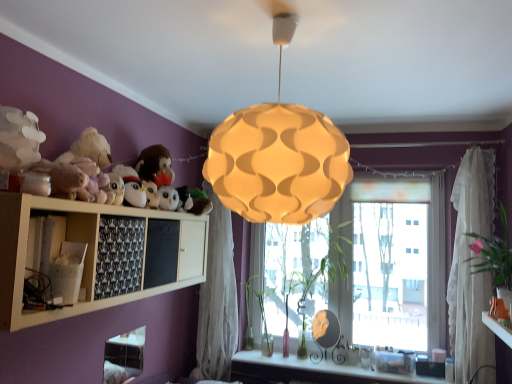
Question: Is fluffy white stuffed animal at upper left, positioned as the first toy in top-to-bottom order, in front of green leafy plant at right, which ranks as the first plant in front-to-back order?

Choices:
 (A) yes
 (B) no

Answer: (A)

Question: Does fluffy white stuffed animal at upper left, the second toy in the right-to-left sequence, have a greater width compared to green leafy plant at right, which is the 4th plant in left-to-right order?

Choices:
 (A) yes
 (B) no

Answer: (B)

Question: From the image's perspective, would you say fluffy white stuffed animal at upper left, the 1th toy in the front-to-back sequence, is shown under green leafy plant at right, which is the 4th plant in left-to-right order?

Choices:
 (A) no
 (B) yes

Answer: (A)

Question: Is fluffy white stuffed animal at upper left, positioned as the first toy in top-to-bottom order, turned away from green leafy plant at right, which ranks as the first plant in front-to-back order?

Choices:
 (A) yes
 (B) no

Answer: (B)

Question: Can you confirm if fluffy white stuffed animal at upper left, the 1th toy from the left, is shorter than green leafy plant at right, which is the first plant from right to left?

Choices:
 (A) no
 (B) yes

Answer: (B)

Question: Can you confirm if fluffy white stuffed animal at upper left, the 1th toy from the left, is thinner than green leafy plant at right, which is the 4th plant in left-to-right order?

Choices:
 (A) yes
 (B) no

Answer: (A)

Question: From the image's perspective, is black fabric at lower left, the second shelf when ordered from left to right, over green glass vase at window, the second plant viewed from the left?

Choices:
 (A) yes
 (B) no

Answer: (A)

Question: Considering the relative sizes of black fabric at lower left, which ranks as the 1th shelf in right-to-left order, and green glass vase at window, which is counted as the second plant, starting from the back, in the image provided, is black fabric at lower left, which ranks as the 1th shelf in right-to-left order, smaller than green glass vase at window, which is counted as the second plant, starting from the back,?

Choices:
 (A) yes
 (B) no

Answer: (A)

Question: Could you tell me if black fabric at lower left, which ranks as the 1th shelf in right-to-left order, is facing green glass vase at window, arranged as the third plant when viewed from the right?

Choices:
 (A) no
 (B) yes

Answer: (A)

Question: Is the depth of black fabric at lower left, the second shelf when ordered from left to right, greater than that of green glass vase at window, arranged as the third plant when viewed from the right?

Choices:
 (A) no
 (B) yes

Answer: (A)

Question: Can you confirm if black fabric at lower left, which ranks as the 1th shelf in right-to-left order, is positioned to the right of green glass vase at window, arranged as the third plant when viewed from the right?

Choices:
 (A) no
 (B) yes

Answer: (A)

Question: Can you confirm if black fabric at lower left, the second shelf when ordered from left to right, is wider than green glass vase at window, which appears as the 3th plant when viewed from the front?

Choices:
 (A) yes
 (B) no

Answer: (B)

Question: Is the surface of white sheer curtain at center, the 2th curtain in the right-to-left sequence, in direct contact with green matte plant at center, which appears as the 2th plant when viewed from the right?

Choices:
 (A) yes
 (B) no

Answer: (B)